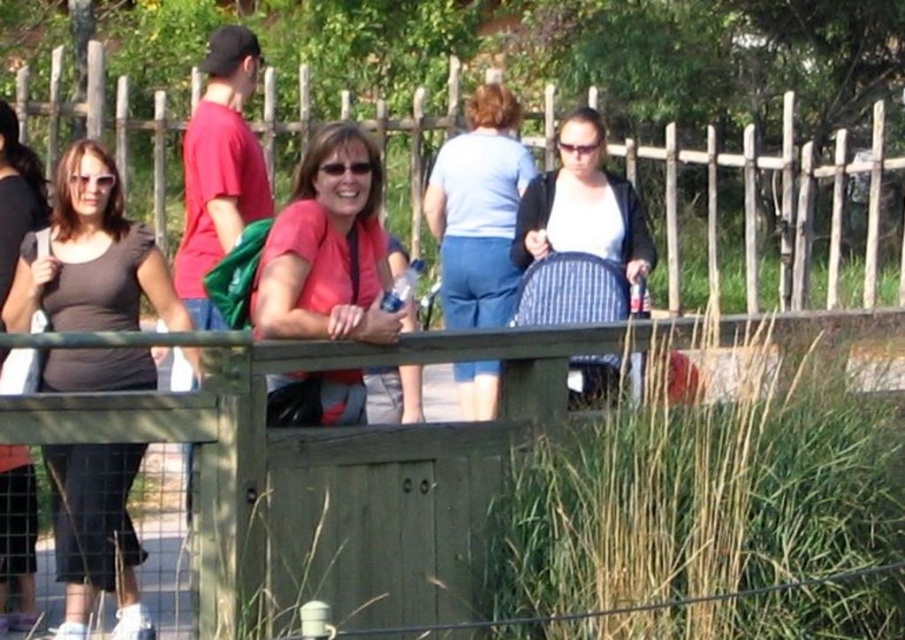
Question: Considering the relative positions of matte black shirt at left and green wooden fence at center in the image provided, where is matte black shirt at left located with respect to green wooden fence at center?

Choices:
 (A) right
 (B) left

Answer: (B)

Question: Considering the real-world distances, which object is closest to the light blue denim pants at center?

Choices:
 (A) green wooden fence at center
 (B) matte black shirt at left
 (C) matte pink shirt at center
 (D) striped fabric stroller at center

Answer: (D)

Question: Is matte pink shirt at center to the left of striped fabric stroller at center from the viewer's perspective?

Choices:
 (A) no
 (B) yes

Answer: (B)

Question: Which of these objects is positioned farthest from the light blue denim pants at center?

Choices:
 (A) striped fabric stroller at center
 (B) green wooden fence at center

Answer: (B)

Question: Does matte black shirt at left appear on the right side of green wooden fence at center?

Choices:
 (A) yes
 (B) no

Answer: (B)

Question: Which of the following is the closest to the observer?

Choices:
 (A) green wooden fence at center
 (B) matte black shirt at left

Answer: (B)